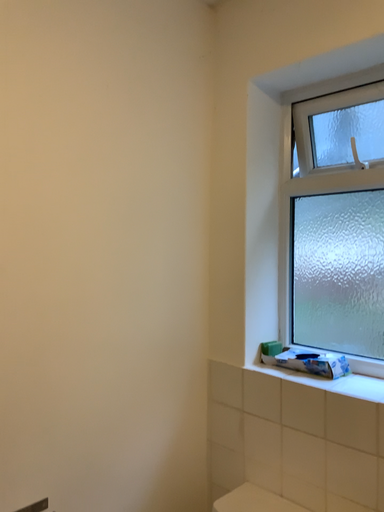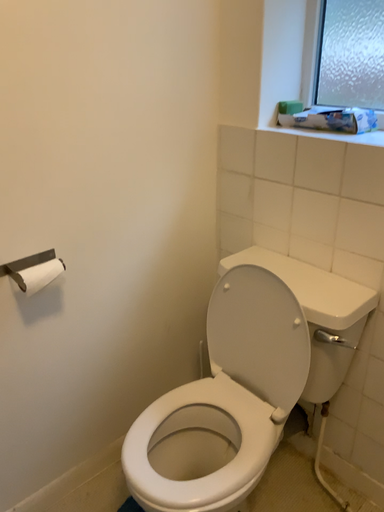
Question: Which way did the camera rotate in the video?

Choices:
 (A) rotated upward
 (B) rotated downward

Answer: (B)